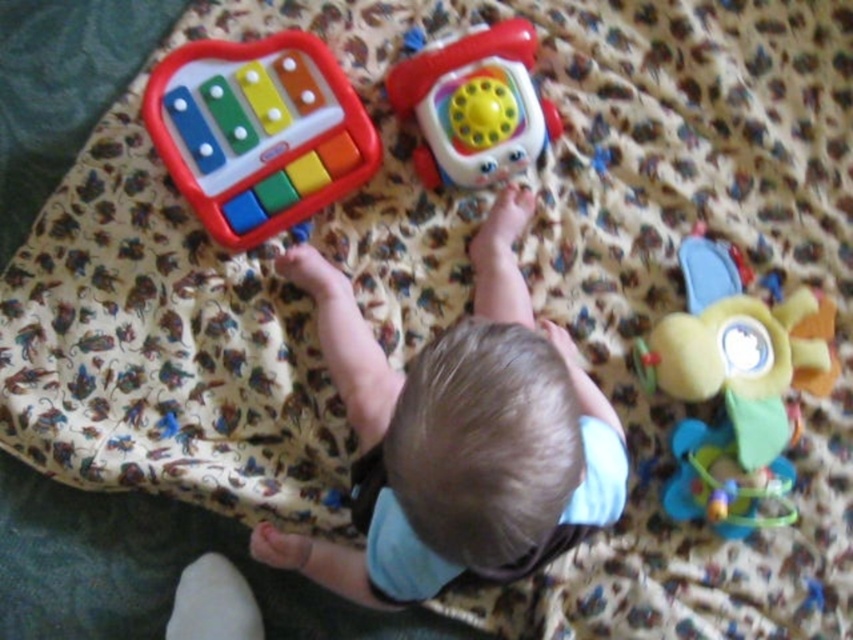
Does light blue fabric at center have a greater width compared to rubberized plastic phone at upper center?

Yes, light blue fabric at center is wider than rubberized plastic phone at upper center.

What do you see at coordinates (459, 436) in the screenshot?
I see `light blue fabric at center` at bounding box center [459, 436].

Describe the element at coordinates (459, 436) in the screenshot. I see `light blue fabric at center` at that location.

The width and height of the screenshot is (853, 640). I want to click on light blue fabric at center, so click(x=459, y=436).

Consider the image. Is light blue fabric at center to the left of plastic xylophone at upper left from the viewer's perspective?

In fact, light blue fabric at center is to the right of plastic xylophone at upper left.

Is light blue fabric at center above plastic xylophone at upper left?

Incorrect, light blue fabric at center is not positioned above plastic xylophone at upper left.

Find the location of `light blue fabric at center`. light blue fabric at center is located at coordinates (459, 436).

Who is taller, soft plush flower at upper center or rubberized plastic phone at upper center?

Standing taller between the two is soft plush flower at upper center.

Does soft plush flower at upper center lie in front of rubberized plastic phone at upper center?

Yes, soft plush flower at upper center is in front of rubberized plastic phone at upper center.

Does point (778, 422) come farther from viewer compared to point (502, 22)?

No, it is not.

You are a GUI agent. You are given a task and a screenshot of the screen. Output one action in this format:
    pyautogui.click(x=<x>, y=<y>)
    Task: Click on the soft plush flower at upper center
    
    Given the screenshot: What is the action you would take?
    pyautogui.click(x=735, y=387)